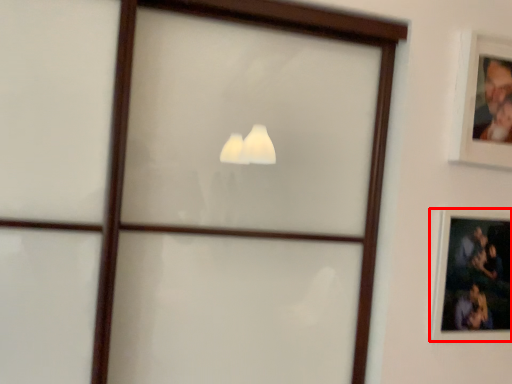
Question: From the image's perspective, what is the correct spatial relationship of picture frame (annotated by the red box) in relation to picture frame?

Choices:
 (A) below
 (B) above

Answer: (A)